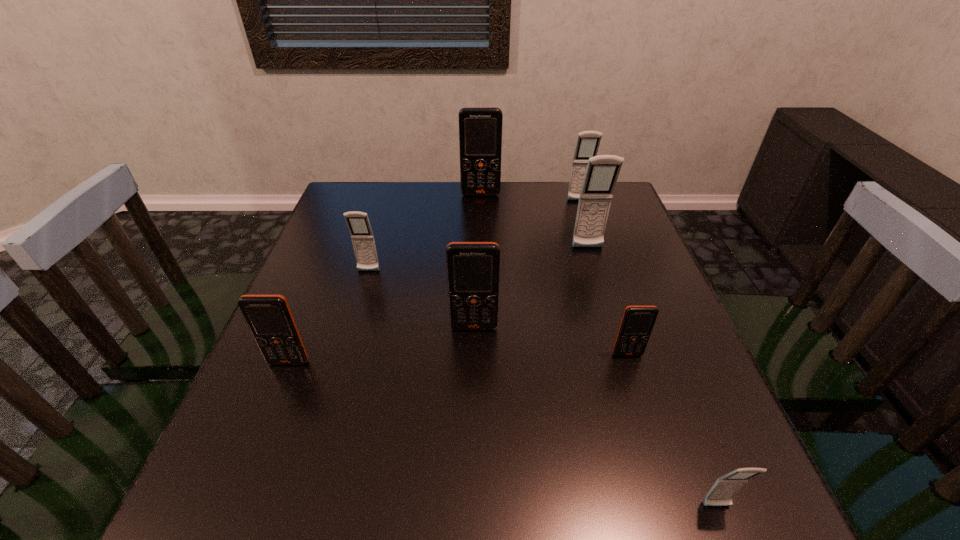
Image resolution: width=960 pixels, height=540 pixels. In order to click on vacant space situated 0.220m on the front-facing side of the fifth nearest object in this screenshot , I will do `click(348, 343)`.

The image size is (960, 540). Find the location of `vacant area situated 0.290m on the screen of the leftmost object`. vacant area situated 0.290m on the screen of the leftmost object is located at coordinates (223, 524).

Find the location of a particular element. Image resolution: width=960 pixels, height=540 pixels. vacant space located on the screen of the third farthest orange cellular telephone is located at coordinates (664, 470).

Where is `object at the near edge`? The image size is (960, 540). object at the near edge is located at coordinates (725, 488).

Find the location of a particular element. The width and height of the screenshot is (960, 540). object that is at the far right corner is located at coordinates (588, 142).

At what (x,y) coordinates should I click in order to perform the action: click on object located at the near right corner. Please return your answer as a coordinate pair (x, y). Looking at the image, I should click on (725, 488).

At what (x,y) coordinates should I click in order to perform the action: click on free location at the far edge of the desktop. Please return your answer as a coordinate pair (x, y). The width and height of the screenshot is (960, 540). Looking at the image, I should click on (516, 205).

You are a GUI agent. You are given a task and a screenshot of the screen. Output one action in this format:
    pyautogui.click(x=<x>, y=<y>)
    Task: Click on the vacant space at the near edge of the desktop
    The height and width of the screenshot is (540, 960).
    Given the screenshot: What is the action you would take?
    pyautogui.click(x=399, y=475)

In the image, there is a desktop. Where is `free space at the left edge`? Image resolution: width=960 pixels, height=540 pixels. free space at the left edge is located at coordinates (277, 422).

Where is `vacant region at the right edge`? vacant region at the right edge is located at coordinates (674, 336).